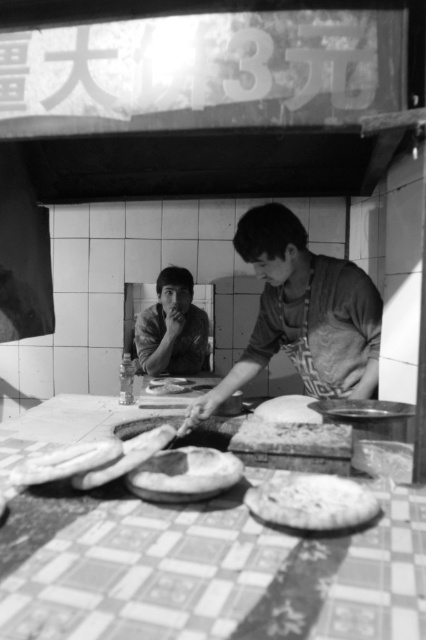
Question: In this image, where is smooth apron at center located relative to soft dough at center?

Choices:
 (A) above
 (B) below

Answer: (A)

Question: Which is nearer to the flaky dough at center?

Choices:
 (A) checkerboard-patterned table at center
 (B) smooth apron at center

Answer: (A)

Question: Which point is closer to the camera taking this photo?

Choices:
 (A) (259, 500)
 (B) (180, 428)
 (C) (307, 419)
 (D) (65, 470)

Answer: (A)

Question: Estimate the real-world distances between objects in this image. Which object is farther from the flaky dough at center?

Choices:
 (A) smooth white rice at center
 (B) smooth apron at center

Answer: (B)

Question: Considering the relative positions of checkerboard-patterned table at center and smooth white rice at center in the image provided, where is checkerboard-patterned table at center located with respect to smooth white rice at center?

Choices:
 (A) left
 (B) right

Answer: (A)

Question: Considering the relative positions of smooth dough at center and smooth white rice at center in the image provided, where is smooth dough at center located with respect to smooth white rice at center?

Choices:
 (A) below
 (B) above

Answer: (A)